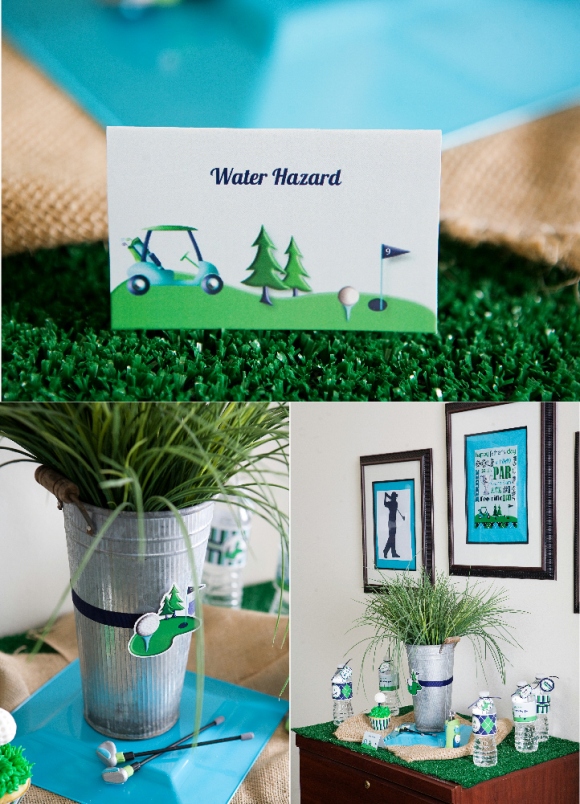
At what (x,y) coordinates should I click in order to perform the action: click on framed golfer shadow. Please return your answer as a coordinate pair (x, y). Looking at the image, I should click on (390, 521).